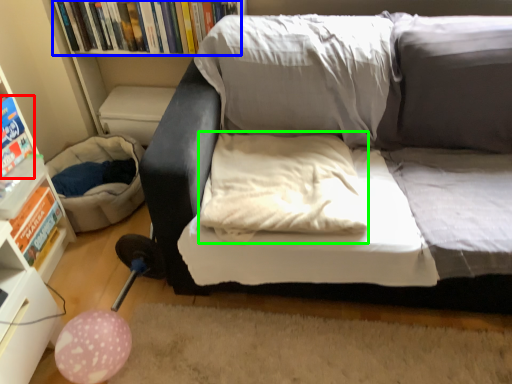
Question: Which object is the closest to the paperback book (highlighted by a red box)? Choose among these: book (highlighted by a blue box) or pillow (highlighted by a green box).

Choices:
 (A) book
 (B) pillow

Answer: (A)